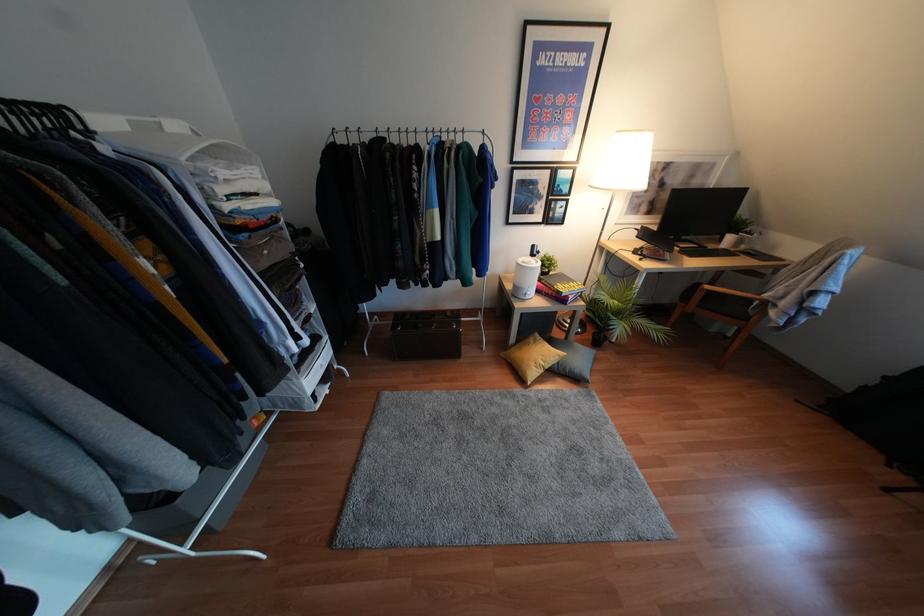
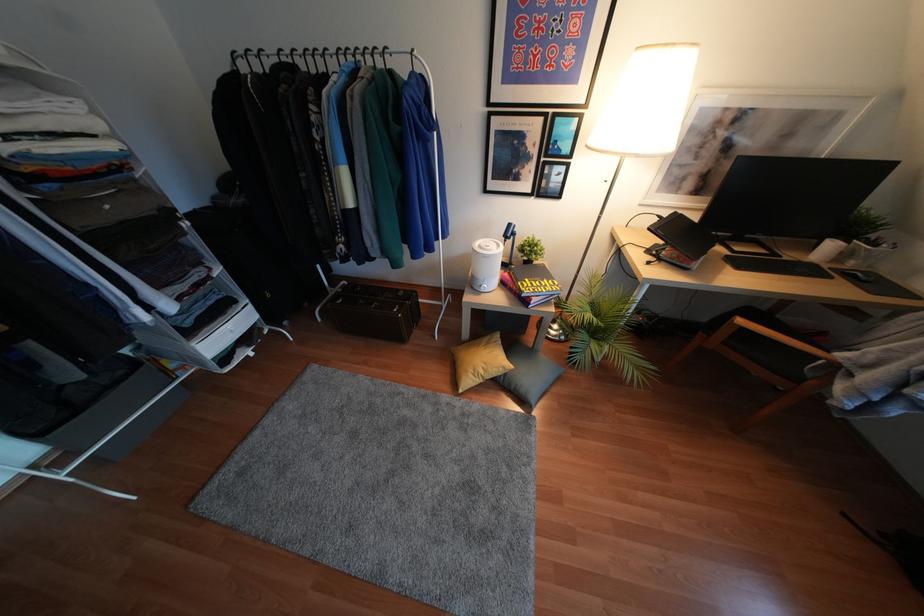
Question: I am providing you with two images of the same scene from different viewpoints. After the viewpoint changes to image2, which objects are now occluded?

Choices:
 (A) gray floor cushion
 (B) small potted plant
 (C) black drawing tablet
 (D) none of these

Answer: (D)